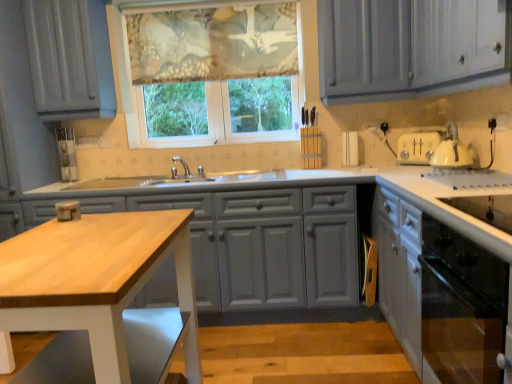
Question: From the image's perspective, would you say textured floral fabric at upper center is shown under wooden table at center?

Choices:
 (A) no
 (B) yes

Answer: (A)

Question: Does textured floral fabric at upper center lie in front of wooden table at center?

Choices:
 (A) no
 (B) yes

Answer: (A)

Question: Is textured floral fabric at upper center at the left side of wooden table at center?

Choices:
 (A) no
 (B) yes

Answer: (A)

Question: Can you confirm if textured floral fabric at upper center is smaller than wooden table at center?

Choices:
 (A) yes
 (B) no

Answer: (A)

Question: Is textured floral fabric at upper center wider than wooden table at center?

Choices:
 (A) no
 (B) yes

Answer: (A)

Question: From a real-world perspective, is textured floral fabric at upper center physically below wooden table at center?

Choices:
 (A) yes
 (B) no

Answer: (B)

Question: Does white glossy cabinet at lower right, which is the first cabinetry in right-to-left order, have a lesser width compared to wooden table at center?

Choices:
 (A) no
 (B) yes

Answer: (B)

Question: Is white glossy cabinet at lower right, which appears as the 2th cabinetry when viewed from the left, positioned in front of wooden table at center?

Choices:
 (A) no
 (B) yes

Answer: (A)

Question: Considering the relative positions of white glossy cabinet at lower right, which appears as the 2th cabinetry when viewed from the left, and wooden table at center in the image provided, is white glossy cabinet at lower right, which appears as the 2th cabinetry when viewed from the left, to the right of wooden table at center from the viewer's perspective?

Choices:
 (A) yes
 (B) no

Answer: (A)

Question: Does white glossy cabinet at lower right, which appears as the 2th cabinetry when viewed from the left, have a larger size compared to wooden table at center?

Choices:
 (A) yes
 (B) no

Answer: (A)

Question: Considering the relative sizes of white glossy cabinet at lower right, which appears as the 2th cabinetry when viewed from the left, and wooden table at center in the image provided, is white glossy cabinet at lower right, which appears as the 2th cabinetry when viewed from the left, shorter than wooden table at center?

Choices:
 (A) yes
 (B) no

Answer: (B)

Question: Is white glossy cabinet at lower right, which appears as the 2th cabinetry when viewed from the left, oriented towards wooden table at center?

Choices:
 (A) yes
 (B) no

Answer: (A)

Question: Is white glossy cabinet at lower right, which appears as the 2th cabinetry when viewed from the left, surrounded by translucent floral fabric at center?

Choices:
 (A) yes
 (B) no

Answer: (B)